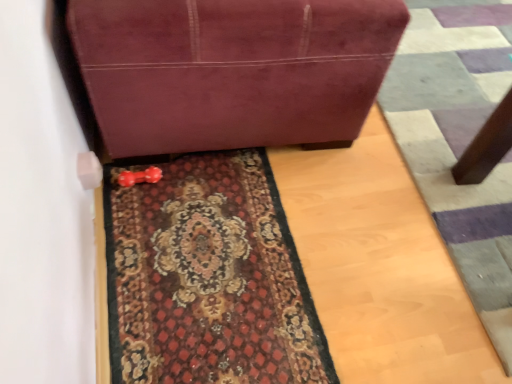
Question: Considering the relative sizes of carpeted doormat at lower center and carpeted mat at center in the image provided, is carpeted doormat at lower center thinner than carpeted mat at center?

Choices:
 (A) yes
 (B) no

Answer: (B)

Question: Is carpeted doormat at lower center oriented away from carpeted mat at center?

Choices:
 (A) yes
 (B) no

Answer: (B)

Question: Is carpeted doormat at lower center not near carpeted mat at center?

Choices:
 (A) no
 (B) yes

Answer: (A)

Question: Is carpeted doormat at lower center completely or partially outside of carpeted mat at center?

Choices:
 (A) yes
 (B) no

Answer: (A)

Question: Considering the relative sizes of carpeted doormat at lower center and carpeted mat at center in the image provided, is carpeted doormat at lower center smaller than carpeted mat at center?

Choices:
 (A) no
 (B) yes

Answer: (A)

Question: Is carpeted mat at center completely or partially inside carpeted doormat at lower center?

Choices:
 (A) no
 (B) yes

Answer: (A)

Question: Is suede-like maroon sofa at upper center looking in the opposite direction of carpeted doormat at lower center?

Choices:
 (A) yes
 (B) no

Answer: (B)

Question: Is the depth of suede-like maroon sofa at upper center less than that of carpeted doormat at lower center?

Choices:
 (A) yes
 (B) no

Answer: (A)

Question: Is suede-like maroon sofa at upper center positioned beyond the bounds of carpeted doormat at lower center?

Choices:
 (A) yes
 (B) no

Answer: (A)

Question: Does suede-like maroon sofa at upper center appear on the right side of carpeted doormat at lower center?

Choices:
 (A) no
 (B) yes

Answer: (A)

Question: Does suede-like maroon sofa at upper center have a greater height compared to carpeted doormat at lower center?

Choices:
 (A) yes
 (B) no

Answer: (A)

Question: From a real-world perspective, is suede-like maroon sofa at upper center located beneath carpeted doormat at lower center?

Choices:
 (A) yes
 (B) no

Answer: (B)

Question: From a real-world perspective, is carpeted mat at center located higher than suede-like maroon sofa at upper center?

Choices:
 (A) no
 (B) yes

Answer: (A)